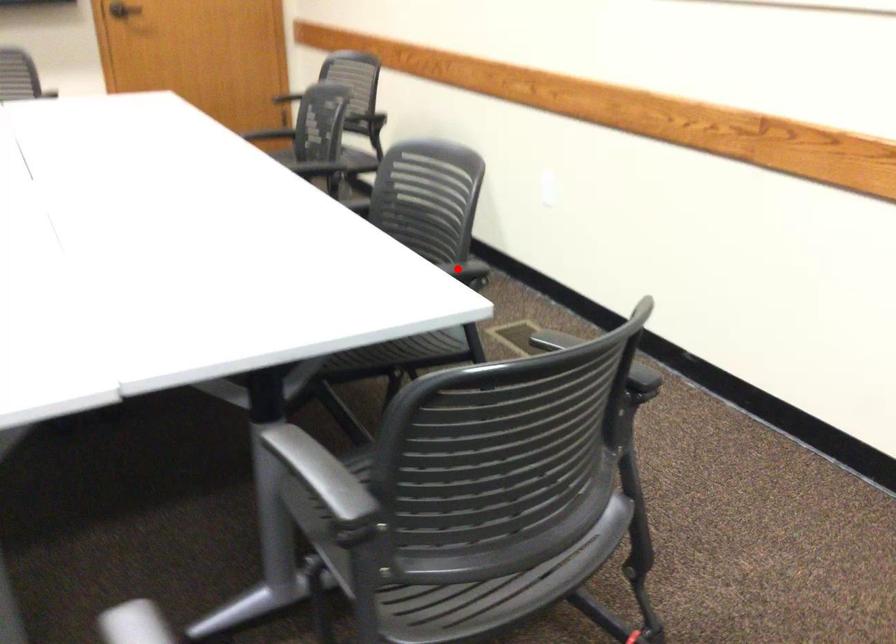
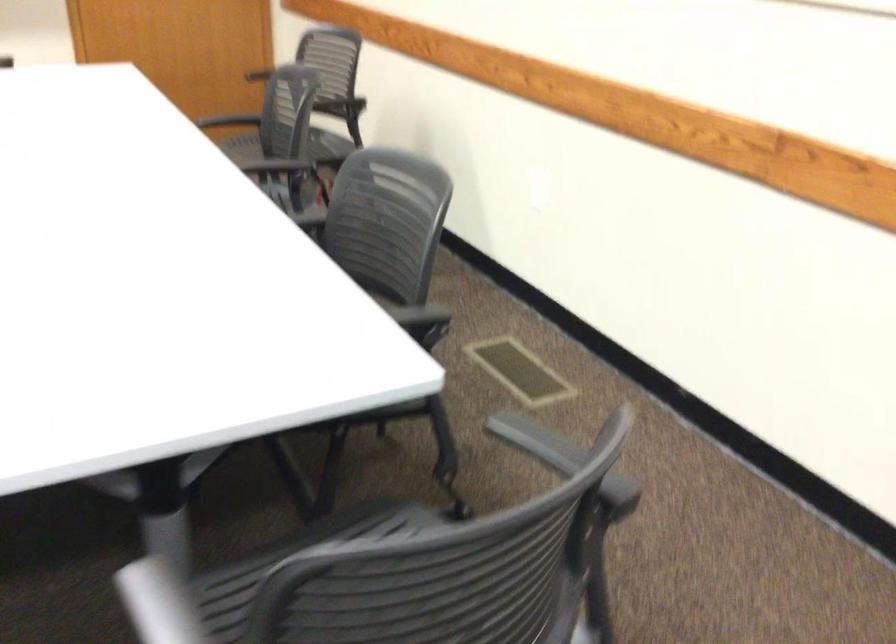
Where in the second image is the point corresponding to the highlighted location from the first image?

(419, 315)